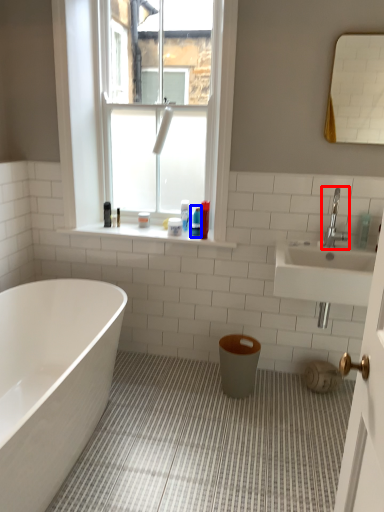
Question: Among these objects, which one is nearest to the camera, tap (highlighted by a red box) or toiletry (highlighted by a blue box)?

Choices:
 (A) tap
 (B) toiletry

Answer: (A)